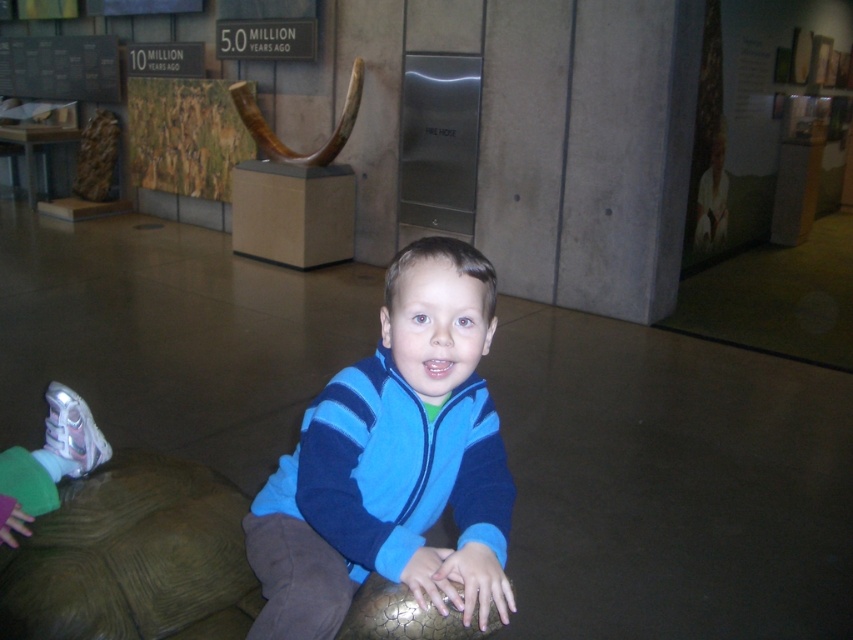
Question: Does blue fleece jacket at center appear over brown textured tortoise at lower left?

Choices:
 (A) yes
 (B) no

Answer: (A)

Question: Among these points, which one is nearest to the camera?

Choices:
 (A) (473, 275)
 (B) (132, 609)

Answer: (A)

Question: Among these objects, which one is farthest from the camera?

Choices:
 (A) blue fleece jacket at center
 (B) brown textured tortoise at lower left

Answer: (B)

Question: In this image, where is blue fleece jacket at center located relative to brown textured tortoise at lower left?

Choices:
 (A) below
 (B) above

Answer: (B)

Question: In this image, where is blue fleece jacket at center located relative to brown textured tortoise at lower left?

Choices:
 (A) left
 (B) right

Answer: (B)